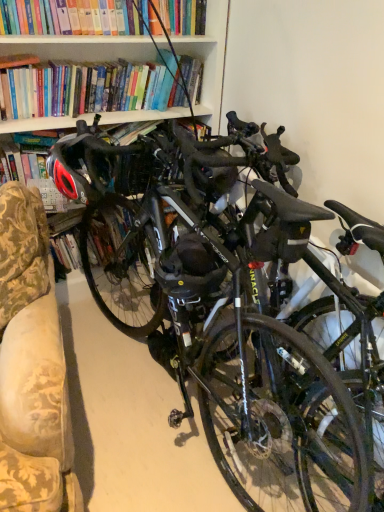
Locate an element on the screen. The width and height of the screenshot is (384, 512). vacant location below shiny black bicycle at center (from a real-world perspective) is located at coordinates (164, 396).